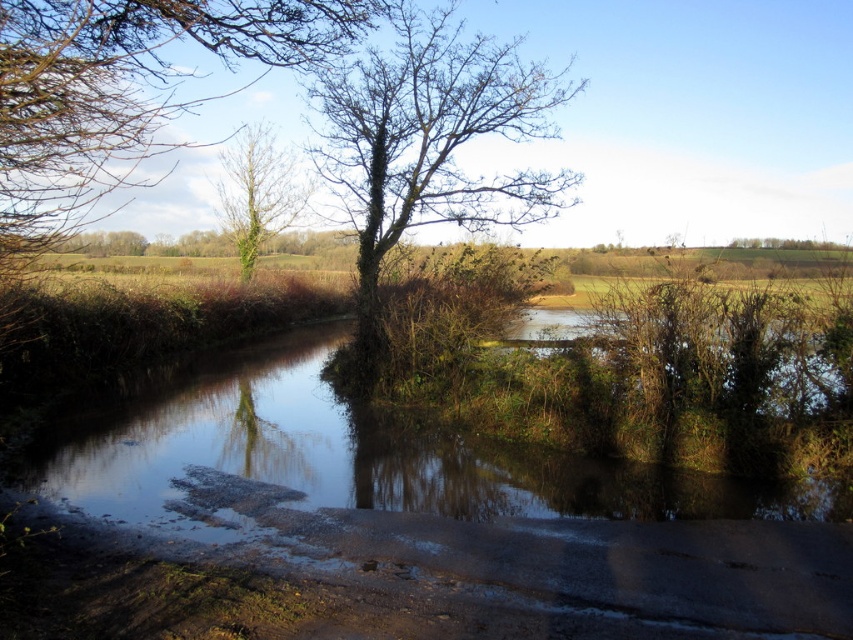
How much distance is there between bare branches at upper left and bare branches at center?

A distance of 4.13 meters exists between bare branches at upper left and bare branches at center.

Which is below, bare branches at upper left or bare branches at center?

Positioned lower is bare branches at center.

Image resolution: width=853 pixels, height=640 pixels. What do you see at coordinates (123, 92) in the screenshot?
I see `bare branches at upper left` at bounding box center [123, 92].

You are a GUI agent. You are given a task and a screenshot of the screen. Output one action in this format:
    pyautogui.click(x=<x>, y=<y>)
    Task: Click on the bare branches at upper left
    This screenshot has height=640, width=853.
    Given the screenshot: What is the action you would take?
    pyautogui.click(x=123, y=92)

Does clear water at center appear on the left side of green leafy tree at upper center?

In fact, clear water at center is to the right of green leafy tree at upper center.

Is clear water at center to the right of green leafy tree at upper center from the viewer's perspective?

Yes, clear water at center is to the right of green leafy tree at upper center.

Which is in front, point (358, 451) or point (245, 129)?

Point (358, 451) is in front.

You are a GUI agent. You are given a task and a screenshot of the screen. Output one action in this format:
    pyautogui.click(x=<x>, y=<y>)
    Task: Click on the clear water at center
    
    Given the screenshot: What is the action you would take?
    pyautogui.click(x=439, y=496)

Is clear water at center behind bare branches at center?

No, clear water at center is in front of bare branches at center.

How much distance is there between clear water at center and bare branches at center?

The distance of clear water at center from bare branches at center is 6.36 meters.

Is point (120, 502) behind point (367, 176)?

That is False.

You are a GUI agent. You are given a task and a screenshot of the screen. Output one action in this format:
    pyautogui.click(x=<x>, y=<y>)
    Task: Click on the clear water at center
    This screenshot has height=640, width=853.
    Given the screenshot: What is the action you would take?
    pyautogui.click(x=439, y=496)